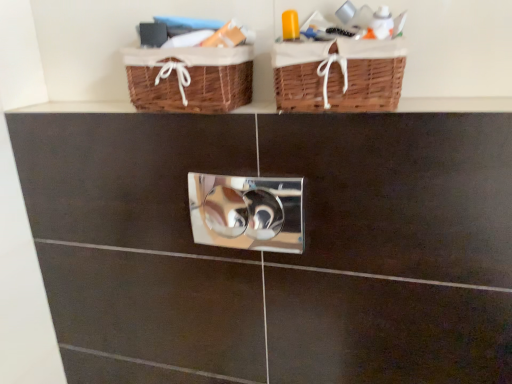
Question: From the image's perspective, is woven brown basket at upper center, the 2th basket when ordered from right to left, positioned above or below polished silver lock at center?

Choices:
 (A) above
 (B) below

Answer: (A)

Question: Based on their positions, is woven brown basket at upper center, the 2th basket when ordered from right to left, located to the left or right of polished silver lock at center?

Choices:
 (A) right
 (B) left

Answer: (B)

Question: Which object is the closest to the woven brown basket at upper center, which is counted as the first basket, starting from the left?

Choices:
 (A) brown wicker baskets at upper center
 (B) woven brown basket at upper center, which appears as the first basket when viewed from the right
 (C) polished silver lock at center

Answer: (B)

Question: Estimate the real-world distances between objects in this image. Which object is closer to the woven brown basket at upper center, the 2th basket viewed from the left?

Choices:
 (A) brown wicker baskets at upper center
 (B) polished silver lock at center
 (C) woven brown basket at upper center, which is counted as the first basket, starting from the left

Answer: (C)